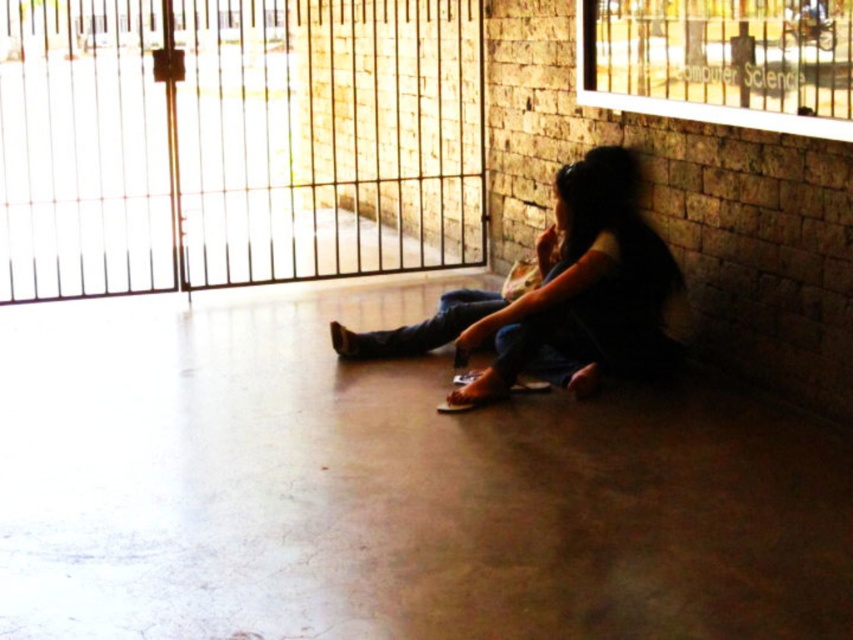
You are trying to decide which item to take with you from the scene. The dark brown leather sandals at lower center and the jeans at center are both on the floor. Which item has a larger size?

The dark brown leather sandals at lower center is larger in size than the jeans at center.

You are standing in the scene and want to move from the dark brown leather sandals at lower center to the jeans at center. Which direction should you move?

To move from the dark brown leather sandals at lower center to the jeans at center, you should move to the left since the sandals are to the right of the jeans.

You are a delivery person who needs to enter through the black metal gate at upper left. However, you are wearing the dark brown leather sandals at lower center. Can your sandals fit under the gate without bending or damaging them?

The black metal gate at upper left is much taller than the dark brown leather sandals at lower center, so the sandals can easily fit under the gate without bending or damaging them.